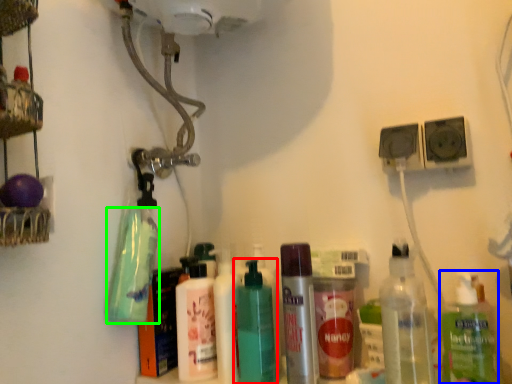
Question: Which object is positioned farthest from bottle (highlighted by a red box)? Select from bottle (highlighted by a blue box) and cleaning product (highlighted by a green box).

Choices:
 (A) bottle
 (B) cleaning product

Answer: (A)